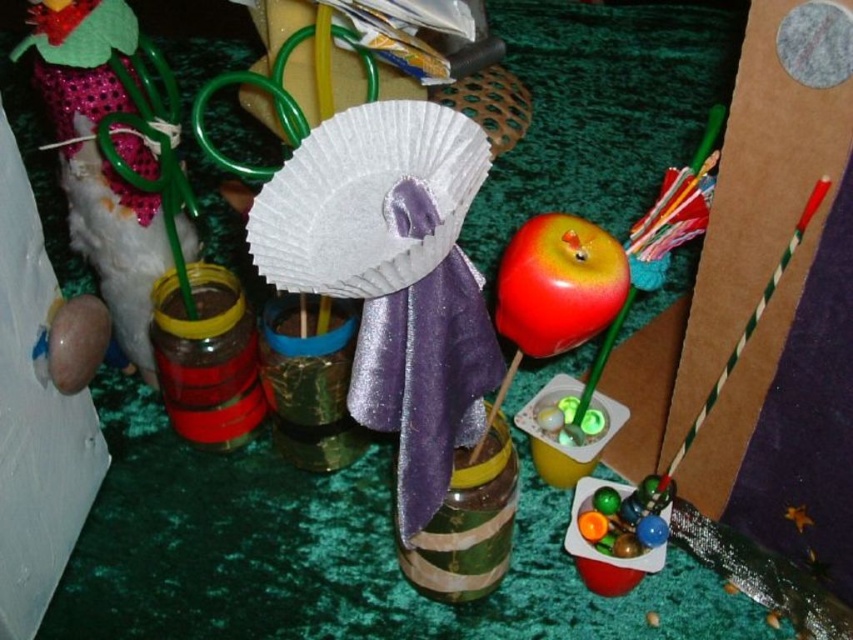
Is point (668, 451) positioned in front of point (125, 212)?

That is True.

Which is behind, point (827, 120) or point (143, 212)?

The point (143, 212) is more distant.

Locate an element on the screen. The width and height of the screenshot is (853, 640). cardboard at right is located at coordinates (x=740, y=259).

How distant is cardboard at right from shiny red apple at center?

cardboard at right is 7.85 inches away from shiny red apple at center.

Is point (689, 305) positioned in front of point (538, 257)?

No, (689, 305) is behind (538, 257).

Is point (769, 68) farther from camera compared to point (550, 310)?

That is True.

Locate an element on the screen. The width and height of the screenshot is (853, 640). cardboard at right is located at coordinates (740, 259).

Based on the photo, does matte brown jar at left appear under shiny red apple at center?

Incorrect, matte brown jar at left is not positioned below shiny red apple at center.

Does matte brown jar at left appear on the right side of shiny red apple at center?

No, matte brown jar at left is not to the right of shiny red apple at center.

Consider the image. Who is more distant from viewer, [32,48] or [573,252]?

Positioned behind is point [32,48].

Identify the location of matte brown jar at left. This screenshot has width=853, height=640. (100, 157).